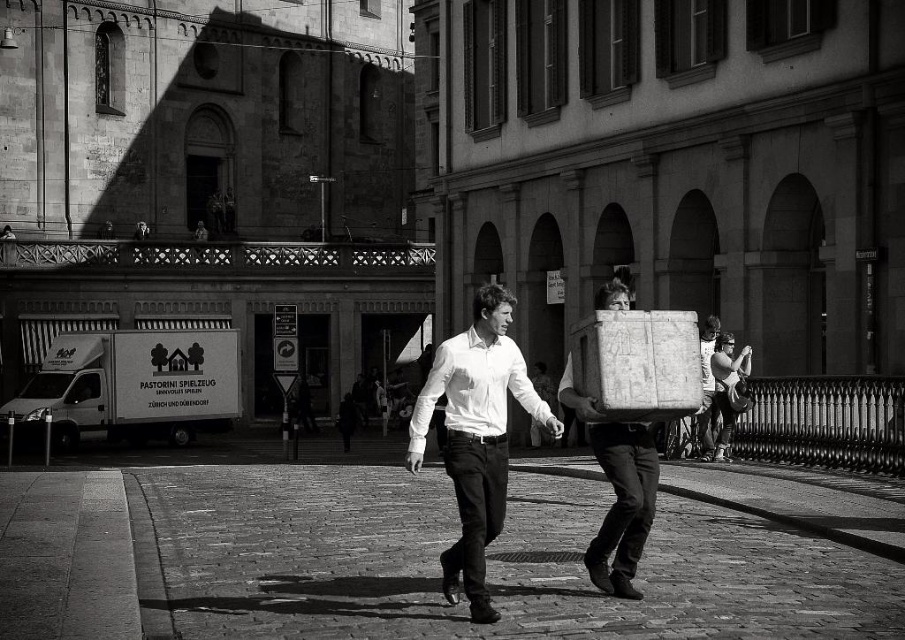
Does smooth cardboard box at center appear on the left side of matte white suitcase at center?

Indeed, smooth cardboard box at center is positioned on the left side of matte white suitcase at center.

At what (x,y) coordinates should I click in order to perform the action: click on smooth cardboard box at center. Please return your answer as a coordinate pair (x, y). Looking at the image, I should click on (617, 490).

Is brick pavement at center to the left of white smooth shirt at center from the viewer's perspective?

Indeed, brick pavement at center is positioned on the left side of white smooth shirt at center.

Is point (505, 609) farther from viewer compared to point (503, 310)?

No, it is in front of (503, 310).

Where is `brick pavement at center`? brick pavement at center is located at coordinates (487, 563).

How much distance is there between brick pavement at center and matte white suitcase at center?

brick pavement at center and matte white suitcase at center are 9.51 meters apart.

Image resolution: width=905 pixels, height=640 pixels. What do you see at coordinates (487, 563) in the screenshot? I see `brick pavement at center` at bounding box center [487, 563].

Image resolution: width=905 pixels, height=640 pixels. Find the location of `brick pavement at center`. brick pavement at center is located at coordinates (487, 563).